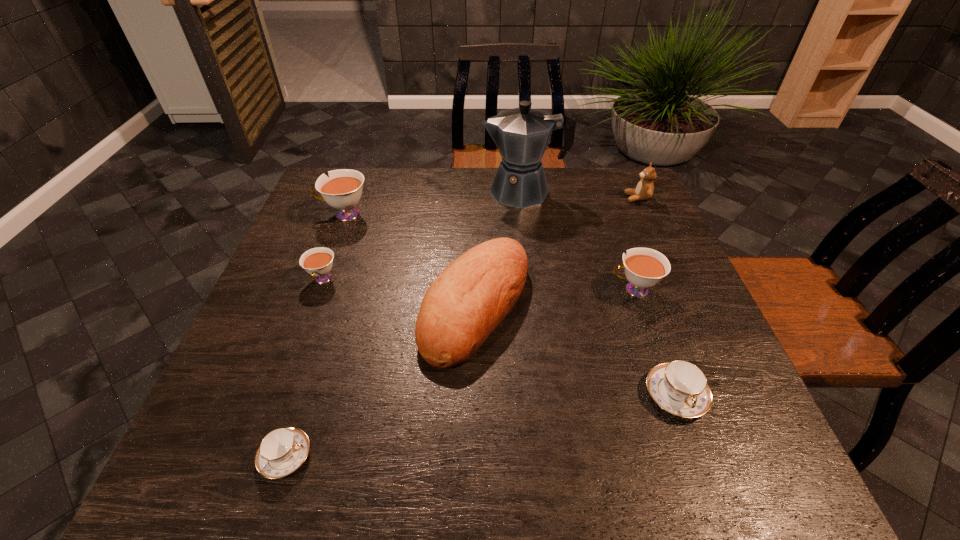
At what (x,y) coordinates should I click in order to perform the action: click on coffeepot. Please return your answer as a coordinate pair (x, y). This screenshot has height=540, width=960. Looking at the image, I should click on (521, 134).

Find the location of a particular element. The height and width of the screenshot is (540, 960). the rightmost object is located at coordinates (644, 190).

Image resolution: width=960 pixels, height=540 pixels. In order to click on the tallest teacup in this screenshot , I will do `click(342, 190)`.

Locate an element on the screen. the farthest white teacup is located at coordinates (342, 190).

Find the location of `bread`. bread is located at coordinates (471, 297).

Locate an element on the screen. The width and height of the screenshot is (960, 540). the fourth shortest object is located at coordinates (644, 267).

The width and height of the screenshot is (960, 540). I want to click on the rightmost white teacup, so click(x=644, y=267).

You are a GUI agent. You are given a task and a screenshot of the screen. Output one action in this format:
    pyautogui.click(x=<x>, y=<y>)
    Task: Click on the smallest white teacup
    
    Given the screenshot: What is the action you would take?
    pyautogui.click(x=318, y=262)

Identify the location of the farther blue teacup. Image resolution: width=960 pixels, height=540 pixels. (680, 387).

Image resolution: width=960 pixels, height=540 pixels. Identify the location of the bigger blue teacup. (680, 387).